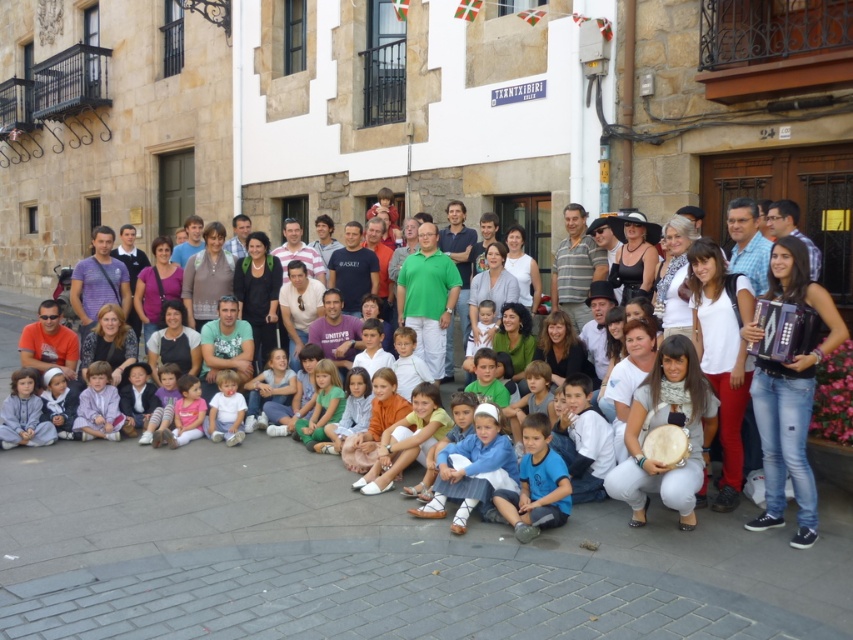
Question: Can you confirm if light purple fabric dress at lower left is positioned to the right of light pink fabric dress at lower left?

Choices:
 (A) yes
 (B) no

Answer: (B)

Question: Among these points, which one is nearest to the camera?

Choices:
 (A) (73, 435)
 (B) (334, 536)

Answer: (B)

Question: Is purple matte accordion at right behind green cotton dress at center?

Choices:
 (A) yes
 (B) no

Answer: (B)

Question: Can you confirm if light blue denim shorts at center is thinner than light blue fabric shirt at lower left?

Choices:
 (A) yes
 (B) no

Answer: (B)

Question: Considering the real-world distances, which object is farthest from the light blue denim shorts at center?

Choices:
 (A) light blue fabric shirt at lower left
 (B) green cotton dress at center
 (C) blue cotton shirt at center
 (D) white cotton shirt at center

Answer: (A)

Question: Estimate the real-world distances between objects in this image. Which object is closer to the light purple fabric dress at lower left?

Choices:
 (A) white cotton shirt at center
 (B) light pink fabric dress at lower left

Answer: (B)